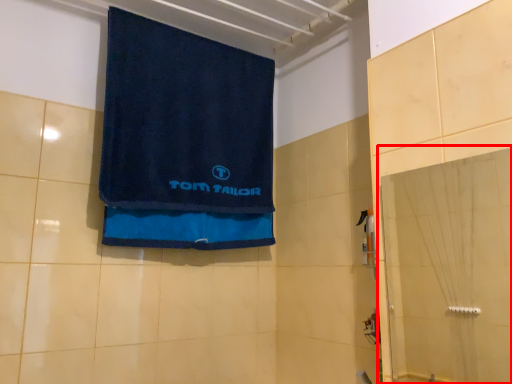
Question: Considering the relative positions of glass door (annotated by the red box) and towel in the image provided, where is glass door (annotated by the red box) located with respect to the staircase?

Choices:
 (A) left
 (B) right

Answer: (B)